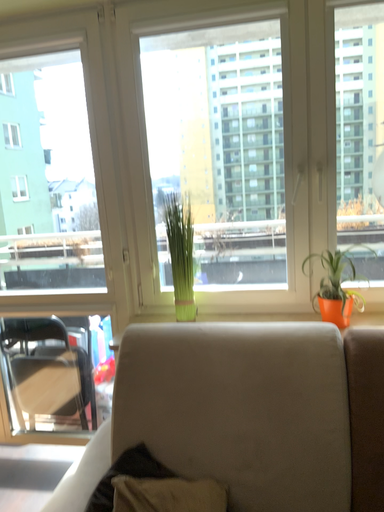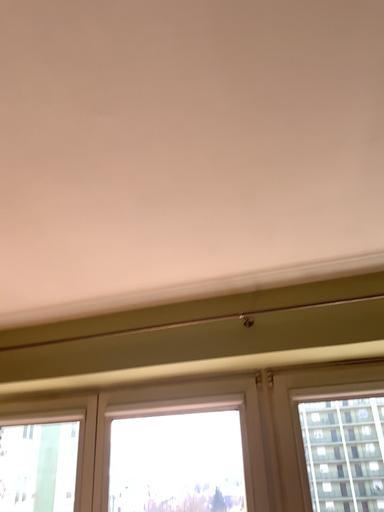
Question: How did the camera likely rotate when shooting the video?

Choices:
 (A) rotated upward
 (B) rotated downward

Answer: (A)